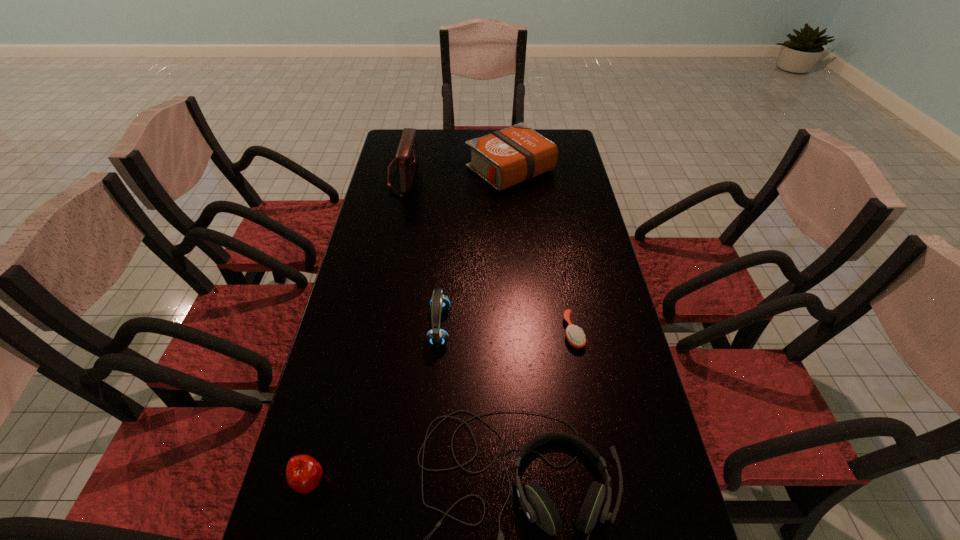
Image resolution: width=960 pixels, height=540 pixels. Find the location of `shoulder bag positioned at the far edge`. shoulder bag positioned at the far edge is located at coordinates (406, 159).

Where is `Bible positioned at the far edge`? The image size is (960, 540). Bible positioned at the far edge is located at coordinates (504, 158).

This screenshot has height=540, width=960. What are the coordinates of `shoulder bag present at the left edge` in the screenshot? It's located at (406, 159).

At what (x,y) coordinates should I click in order to perform the action: click on apple positioned at the left edge. Please return your answer as a coordinate pair (x, y). Looking at the image, I should click on (303, 473).

Locate an element on the screen. Bible at the right edge is located at coordinates (504, 158).

At what (x,y) coordinates should I click in order to perform the action: click on hairbrush present at the right edge. Please return your answer as a coordinate pair (x, y). Looking at the image, I should click on (575, 336).

Image resolution: width=960 pixels, height=540 pixels. I want to click on object that is at the far left corner, so click(406, 159).

Identify the location of object situated at the far right corner. The width and height of the screenshot is (960, 540). (504, 158).

The width and height of the screenshot is (960, 540). Find the location of `vacant space at the far edge of the desktop`. vacant space at the far edge of the desktop is located at coordinates (436, 141).

Locate an element on the screen. The width and height of the screenshot is (960, 540). free spot at the left edge of the desktop is located at coordinates (387, 325).